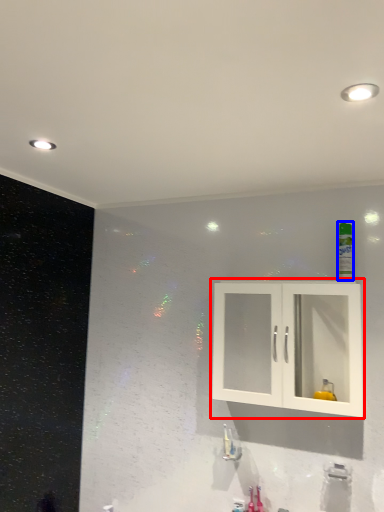
Question: Which object appears closest to the camera in this image, cabinetry (highlighted by a red box) or mouthwash (highlighted by a blue box)?

Choices:
 (A) cabinetry
 (B) mouthwash

Answer: (A)